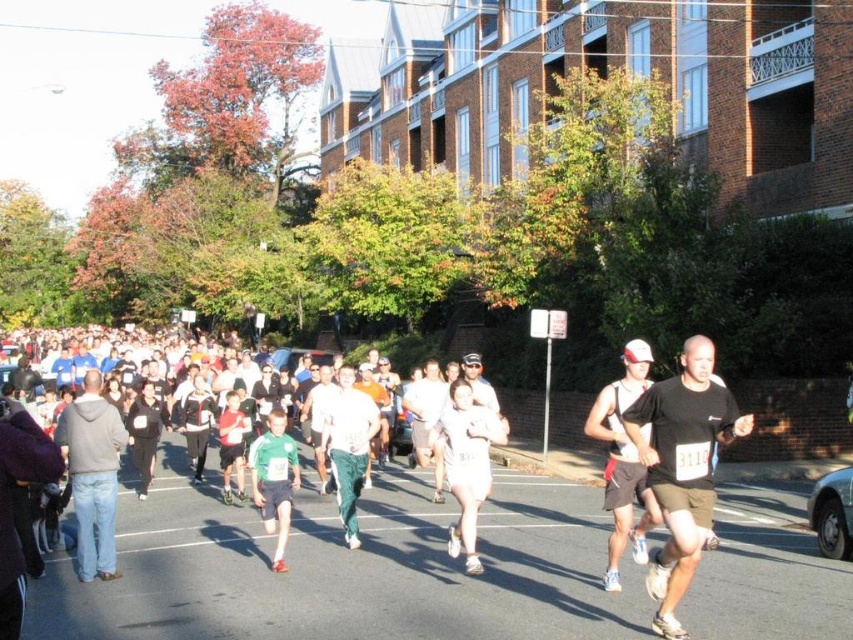
Can you confirm if black matte shirt at center is bigger than green fabric shorts at center?

No.

Which of these two, black matte shirt at center or green fabric shorts at center, stands taller?

With more height is green fabric shorts at center.

The width and height of the screenshot is (853, 640). What do you see at coordinates (682, 468) in the screenshot? I see `black matte shirt at center` at bounding box center [682, 468].

Identify the location of black matte shirt at center. (682, 468).

Can you confirm if black matte shirt at center is positioned to the left of gray hoodie at left?

In fact, black matte shirt at center is to the right of gray hoodie at left.

Does point (657, 387) come in front of point (74, 408)?

Yes, point (657, 387) is in front of point (74, 408).

The height and width of the screenshot is (640, 853). In order to click on black matte shirt at center in this screenshot , I will do [682, 468].

Between point (618, 515) and point (351, 486), which one is positioned behind?

Point (351, 486)

Describe the element at coordinates (624, 461) in the screenshot. I see `matte black tank top at center` at that location.

This screenshot has height=640, width=853. What are the coordinates of `matte black tank top at center` in the screenshot? It's located at (624, 461).